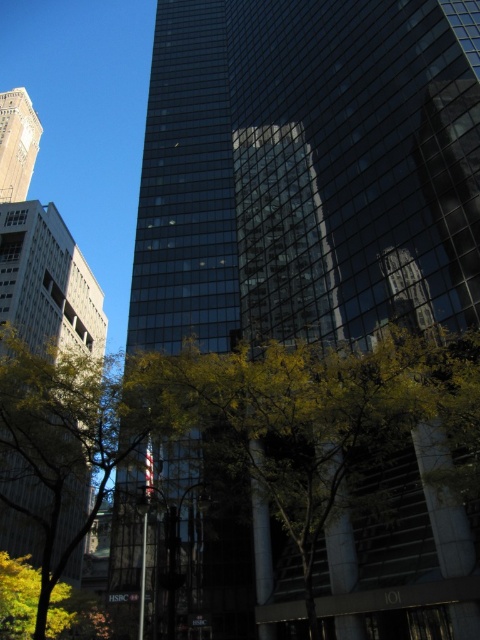
Between white concrete building at left and matte gold clock tower at upper left, which one appears on the right side from the viewer's perspective?

white concrete building at left

Which is above, white concrete building at left or matte gold clock tower at upper left?

matte gold clock tower at upper left

Describe the element at coordinates (48, 282) in the screenshot. I see `white concrete building at left` at that location.

This screenshot has width=480, height=640. Identify the location of white concrete building at left. (48, 282).

Can you confirm if green leafy tree at center is positioned below white concrete building at left?

No.

Is point (441, 468) more distant than point (12, 289)?

No.

Is point (248, 420) closer to viewer compared to point (9, 269)?

Yes, point (248, 420) is closer to viewer.

Where is `green leafy tree at center`? Image resolution: width=480 pixels, height=640 pixels. green leafy tree at center is located at coordinates (304, 416).

Consider the image. Is green leafy tree at center further to camera compared to matte gold clock tower at upper left?

That is False.

Can you confirm if green leafy tree at center is positioned to the right of matte gold clock tower at upper left?

Correct, you'll find green leafy tree at center to the right of matte gold clock tower at upper left.

Find the location of a particular element. Image resolution: width=480 pixels, height=640 pixels. green leafy tree at center is located at coordinates (304, 416).

Locate an element on the screen. Image resolution: width=480 pixels, height=640 pixels. green leafy tree at center is located at coordinates pyautogui.click(x=304, y=416).